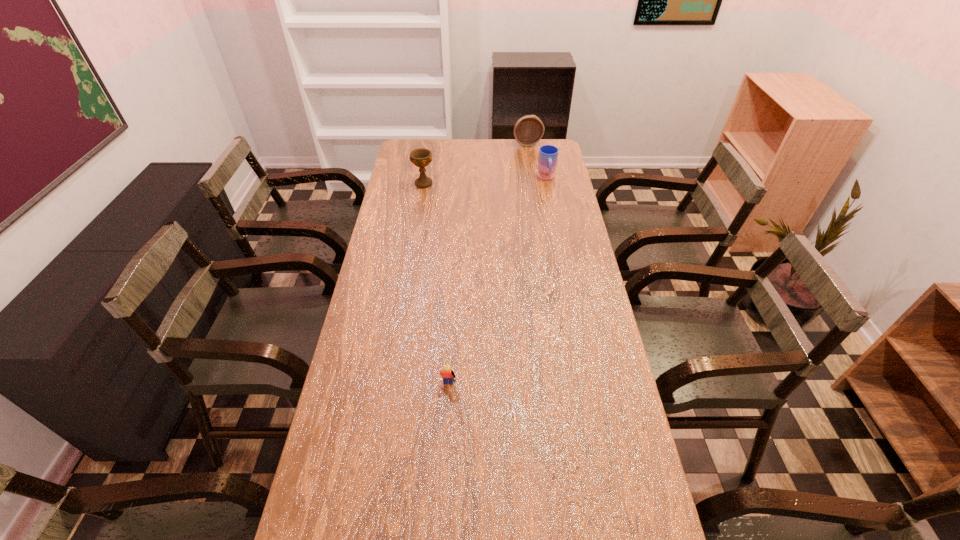
What are the coordinates of `vacant area between the second object from left to right and the farthest object` in the screenshot? It's located at (488, 266).

Find the location of a particular element. The width and height of the screenshot is (960, 540). unoccupied area between the leftmost object and the farthest object is located at coordinates (475, 163).

Where is `the third closest object to the third object from right to left`? This screenshot has width=960, height=540. the third closest object to the third object from right to left is located at coordinates (528, 130).

Find the location of a particular element. The height and width of the screenshot is (540, 960). object that stands as the closest to the nearest object is located at coordinates (421, 157).